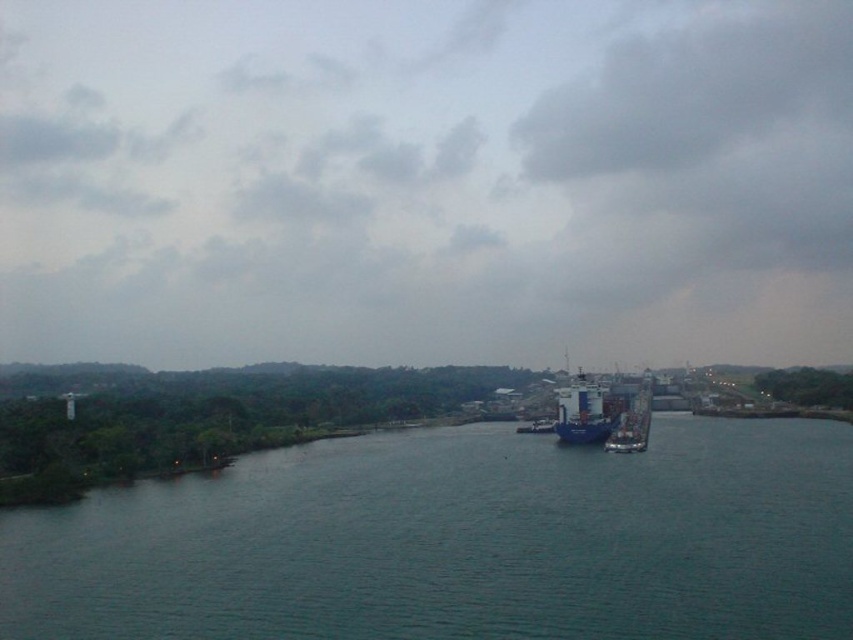
You are a drone operator tasked with capturing aerial footage of the dark blue water at center and the blue matte container ship at center. Based on the scene, which object should you adjust your camera angle upwards to focus on?

You should adjust your camera angle upwards to focus on the blue matte container ship at center because it is taller than the dark blue water at center.

What are the coordinates of the blue matte container ship at center?

The coordinates of the blue matte container ship at center are at point (582, 412).

Based on the photo, you are a photographer planning to capture the entire blue metallic cargo ship at center and the dark blue water at center in a single frame. Given that your camera has a fixed focal length, which object should you position closer to ensure both fit in the frame?

Since the dark blue water at center is wider than the blue metallic cargo ship at center, you should position yourself closer to the blue metallic cargo ship at center to ensure both fit within the frame.